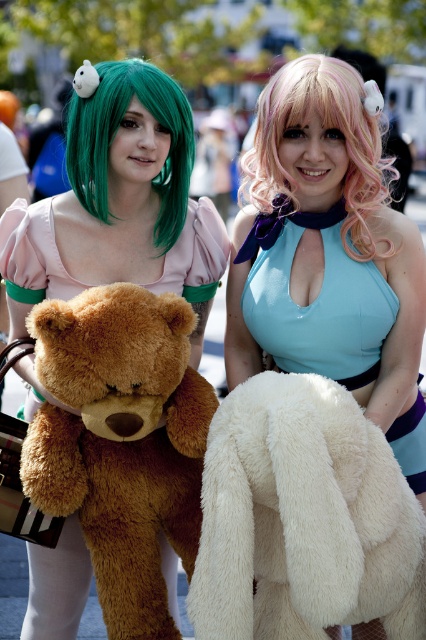
Question: Is brown plush teddy bear at left smaller than light blue satin dress at center?

Choices:
 (A) no
 (B) yes

Answer: (A)

Question: Is light blue satin dress at center smaller than pink wavy wig at upper center?

Choices:
 (A) yes
 (B) no

Answer: (A)

Question: Which point is closer to the camera taking this photo?

Choices:
 (A) (359, 323)
 (B) (181, 323)
 (C) (399, 362)

Answer: (B)

Question: Which of the following is the farthest from the observer?

Choices:
 (A) (365, 211)
 (B) (39, 502)
 (C) (103, 148)
 (D) (333, 83)

Answer: (A)

Question: Does light blue satin dress at center appear on the right side of green matte wig at upper left?

Choices:
 (A) no
 (B) yes

Answer: (B)

Question: Which object appears closest to the camera in this image?

Choices:
 (A) light blue satin dress at center
 (B) brown plush teddy bear at left

Answer: (B)